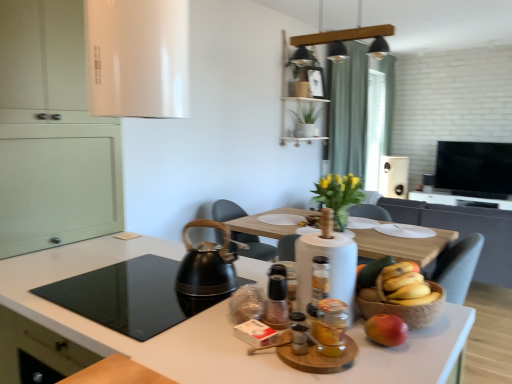
You are a GUI agent. You are given a task and a screenshot of the screen. Output one action in this format:
    pyautogui.click(x=<x>, y=<y>)
    Task: Click on the free space that is to the left of black matte tea kettle at center
    The height and width of the screenshot is (384, 512).
    Given the screenshot: What is the action you would take?
    pyautogui.click(x=143, y=287)